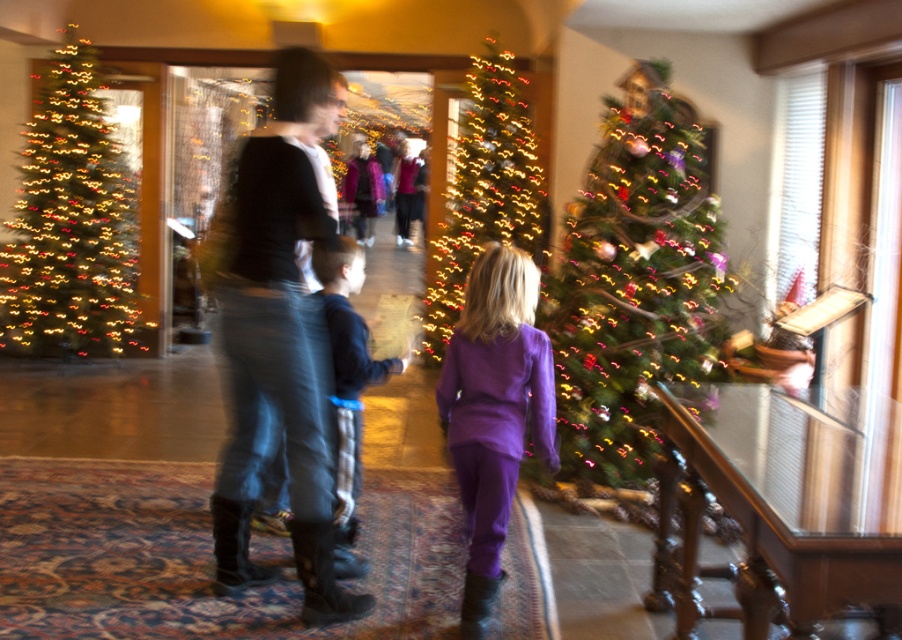
Question: Does shiny green tree at center appear over illuminated glass christmas tree at center?

Choices:
 (A) yes
 (B) no

Answer: (B)

Question: Which point is farther from the camera taking this photo?

Choices:
 (A) (600, 422)
 (B) (468, 600)
 (C) (79, 128)

Answer: (C)

Question: Is illuminated glass christmas tree at center behind velvet purple coat at center?

Choices:
 (A) no
 (B) yes

Answer: (A)

Question: Which point is farther from the camera taking this photo?

Choices:
 (A) (462, 612)
 (B) (281, 348)
 (C) (631, 412)

Answer: (C)

Question: Which object is farther from the camera taking this photo?

Choices:
 (A) multicolored lights christmas tree at left
 (B) denim jeans at center
 (C) illuminated glass christmas tree at center

Answer: (A)

Question: Is denim jeans at center smaller than multicolored lights christmas tree at left?

Choices:
 (A) no
 (B) yes

Answer: (B)